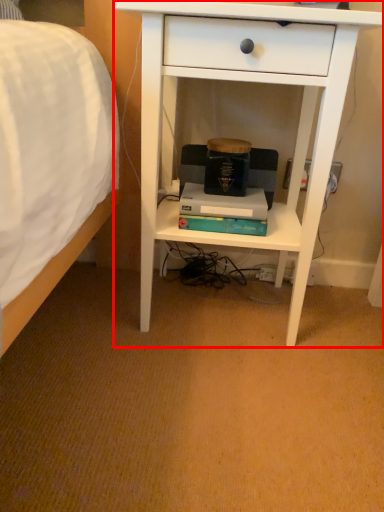
Question: Observing the image, what is the correct spatial positioning of desk (annotated by the red box) in reference to paperback book?

Choices:
 (A) right
 (B) left

Answer: (A)